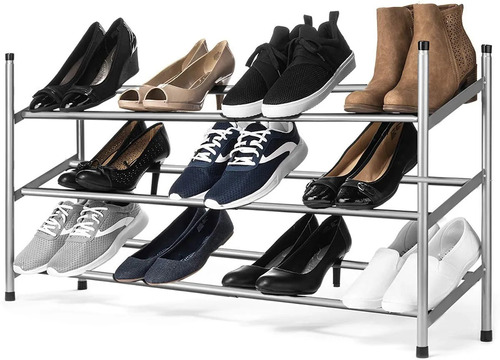
This screenshot has width=500, height=360. I want to click on metal bars holding shoes, so click(x=190, y=285), click(x=277, y=208), click(x=320, y=112), click(x=314, y=172), click(x=341, y=84), click(x=249, y=251).